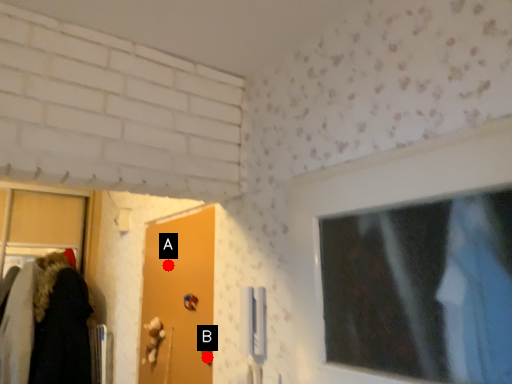
Question: Two points are circled on the image, labeled by A and B beside each circle. Which point appears closest to the camera in this image?

Choices:
 (A) A is closer
 (B) B is closer

Answer: (B)